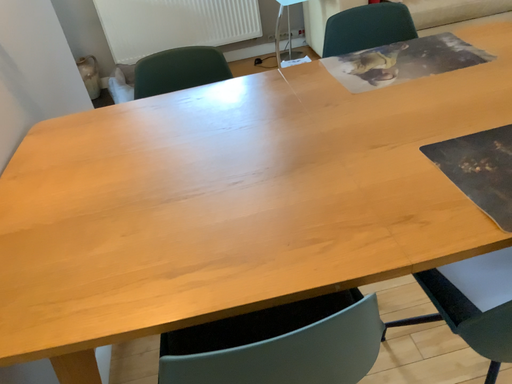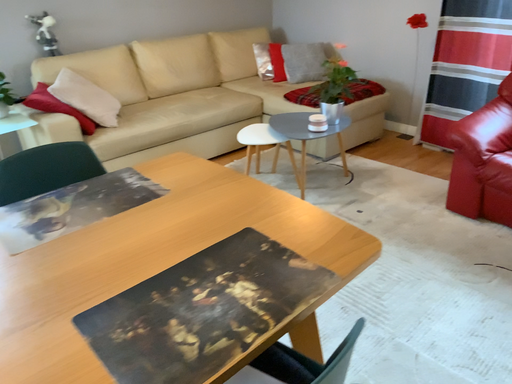
Question: Which way did the camera rotate in the video?

Choices:
 (A) rotated upward
 (B) rotated downward

Answer: (A)